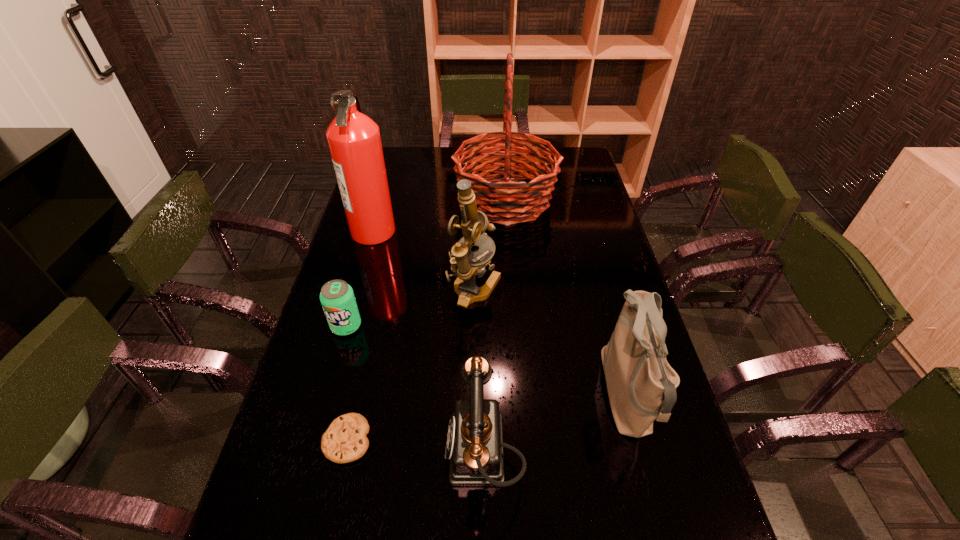
Find the location of `vacant space located 0.110m on the front of the cookie`. vacant space located 0.110m on the front of the cookie is located at coordinates (329, 521).

Locate an element on the screen. Image resolution: width=960 pixels, height=540 pixels. object positioned at the far edge is located at coordinates (493, 196).

I want to click on fire extinguisher located in the left edge section of the desktop, so click(x=354, y=141).

This screenshot has height=540, width=960. In order to click on pop soda at the left edge in this screenshot , I will do `click(337, 298)`.

Image resolution: width=960 pixels, height=540 pixels. Find the location of `cookie located in the left edge section of the desktop`. cookie located in the left edge section of the desktop is located at coordinates (345, 440).

Where is `basket present at the right edge`? basket present at the right edge is located at coordinates (493, 196).

Identify the location of shoulder bag present at the right edge. (641, 384).

I want to click on object located in the far right corner section of the desktop, so click(493, 196).

This screenshot has height=540, width=960. Find the location of `free space at the left edge of the desktop`. free space at the left edge of the desktop is located at coordinates (300, 424).

Locate an element on the screen. This screenshot has width=960, height=540. vacant space at the right edge of the desktop is located at coordinates (605, 225).